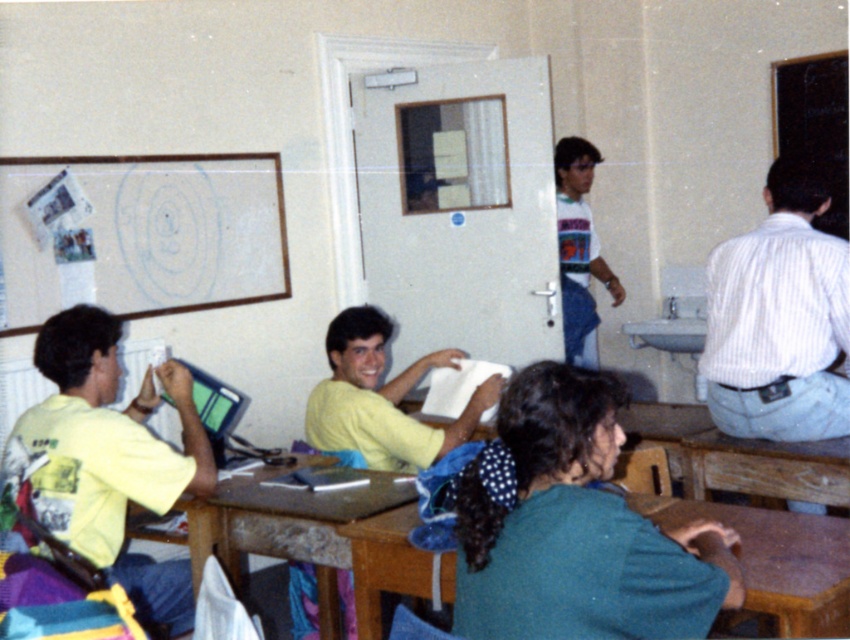
Question: Which is farther from the white printed t-shirt at center?

Choices:
 (A) yellow matte shirt at left
 (B) white paperboard at upper left
 (C) brown wooden table at lower center

Answer: (A)

Question: Is brown wooden table at lower center to the right of yellow matte shirt at center from the viewer's perspective?

Choices:
 (A) yes
 (B) no

Answer: (A)

Question: Is dark green sweater at center to the right of white printed t-shirt at center from the viewer's perspective?

Choices:
 (A) yes
 (B) no

Answer: (B)

Question: Does yellow matte shirt at center appear on the right side of white printed t-shirt at center?

Choices:
 (A) no
 (B) yes

Answer: (A)

Question: Based on their relative distances, which object is farther from the white paperboard at upper left?

Choices:
 (A) brown wooden table at lower center
 (B) yellow matte shirt at center
 (C) dark green sweater at center

Answer: (C)

Question: Estimate the real-world distances between objects in this image. Which object is closer to the yellow matte shirt at left?

Choices:
 (A) white paperboard at upper left
 (B) dark green sweater at center

Answer: (A)